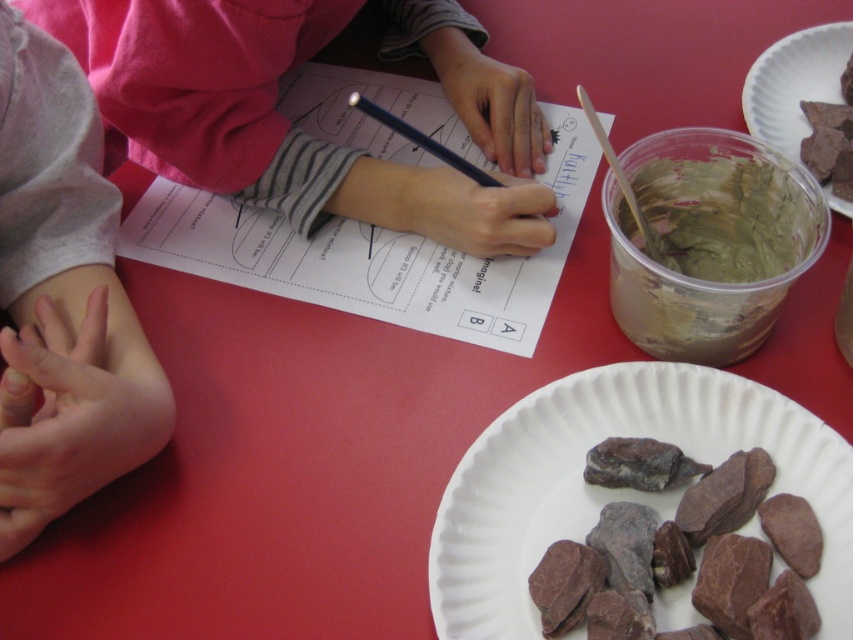
You are a teacher observing a classroom activity. You notice the matte pink shirt at upper left and the chocolate cake at upper right on the table. Which object takes up more space on the table?

The matte pink shirt at upper left takes up more space on the table because it has a larger size compared to the chocolate cake at upper right.

You are a photographer setting up a shot of the scene. The matte pink shirt at upper left and the chocolate cake at upper right are both in the frame. Which object should you adjust to ensure they are both fully visible if the frame is too narrow?

Since the matte pink shirt at upper left is wider than the chocolate cake at upper right, you should adjust the matte pink shirt at upper left to make it fit within the frame.

You are a teacher observing a classroom activity. You notice the matte pink shirt at upper left and the brown matte paper plate at upper right. Which object is positioned higher up in the image?

The matte pink shirt at upper left is taller than the brown matte paper plate at upper right, so the matte pink shirt at upper left is positioned higher up in the image.